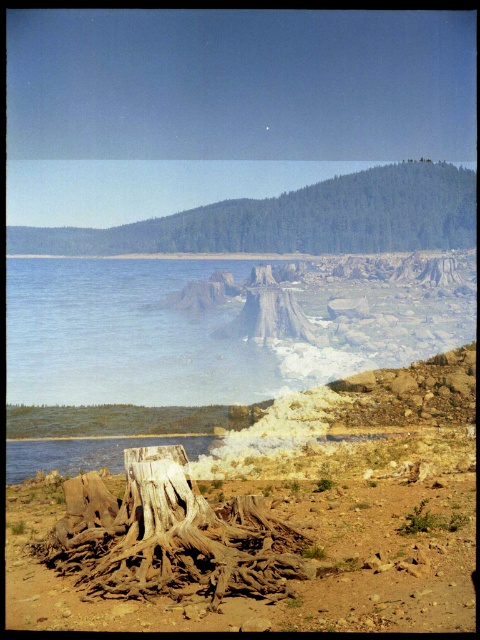
You are standing at the lakeside and want to walk from the light brown wood at center to the brown textured tree stump at center. Is the path directly between them clear of obstacles?

The light brown wood at center is in front of the brown textured tree stump at center, so the path between them is clear of obstacles.

You are standing at the lakeside and want to walk towards the point labeled as point (245, 545). However, there is an obstacle at point (402, 586). Will you encounter this obstacle before reaching your destination?

Yes, you will encounter the obstacle at point (402, 586) before reaching your destination at point (245, 545) because point (402, 586) is in front of point (245, 545).

You are standing at the edge of the lake and see the brown rough tree roots at lower center marked by point (292,582). Based on the scene description, what is the most likely reason these roots are exposed?

The roots are exposed due to natural erosion or deforestation as mentioned in the scene description.